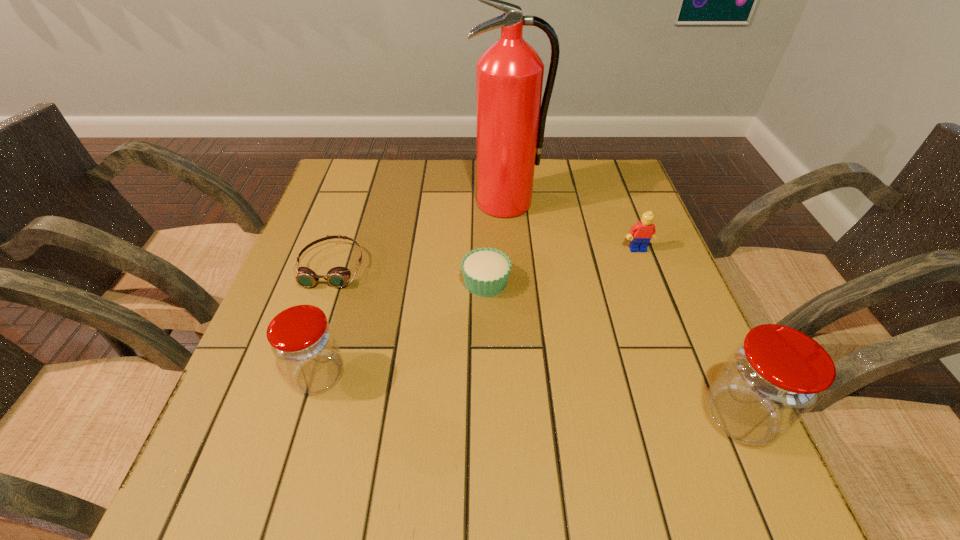
This screenshot has height=540, width=960. What are the coordinates of `free space that satisfies the following two spatial constraints: 1. through the lenses of the goggles; 2. on the left side of the shorter jar` in the screenshot? It's located at (295, 375).

The height and width of the screenshot is (540, 960). In order to click on free location that satisfies the following two spatial constraints: 1. at the nozzle of the tallest object; 2. on the left side of the right jar in this screenshot , I will do `click(522, 417)`.

The height and width of the screenshot is (540, 960). What are the coordinates of `free space that satisfies the following two spatial constraints: 1. at the nozzle of the tallest object; 2. on the left side of the right jar` in the screenshot? It's located at (522, 417).

Locate an element on the screen. The image size is (960, 540). free space that satisfies the following two spatial constraints: 1. at the nozzle of the farthest object; 2. on the right side of the taller jar is located at coordinates (522, 417).

This screenshot has width=960, height=540. Find the location of `vacant region that satisfies the following two spatial constraints: 1. on the face of the second tallest object; 2. on the right side of the Lego`. vacant region that satisfies the following two spatial constraints: 1. on the face of the second tallest object; 2. on the right side of the Lego is located at coordinates [702, 417].